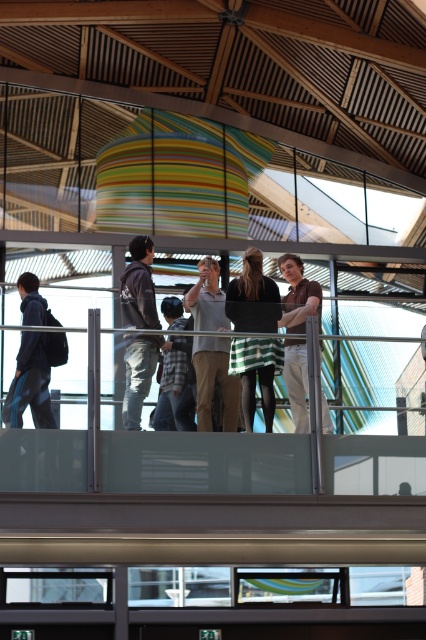
You are standing on the glass walkway and want to find the green striped dress at center. Based on the coordinates provided, where should you look relative to the glass walkway?

The green striped dress at center is located at coordinates 0.466 on the x axis and 0.594 on the y axis relative to the glass walkway.

You are standing on the glass walkway and notice two people wearing the green striped dress at center and the light gray cotton shirt at center. Which clothing item is closer to the ground?

The green striped dress at center is closer to the ground because it is located below the light gray cotton shirt at center.

You are standing on the glass walkway and notice two shirts hanging from the railing. The light gray cotton shirt at center and the brown cotton shirt at center. Which shirt has a larger width?

The light gray cotton shirt at center might be wider than brown cotton shirt at center according to the description.